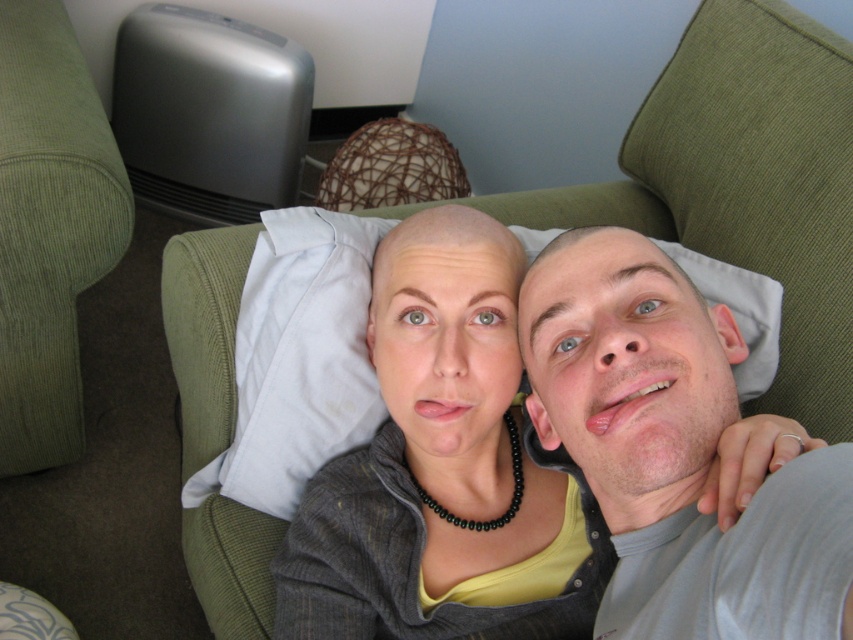
Which is above, matte gray sweater at center or white fabric pillow at center?

Positioned higher is white fabric pillow at center.

Is matte gray sweater at center to the left of white fabric pillow at center from the viewer's perspective?

Yes, matte gray sweater at center is to the left of white fabric pillow at center.

Between point (381, 634) and point (366, 428), which one is positioned behind?

The point (366, 428) is behind.

The width and height of the screenshot is (853, 640). What are the coordinates of `matte gray sweater at center` in the screenshot? It's located at (444, 468).

Is matte gray sweater at center positioned behind gray fabric shirt at upper right?

Yes, matte gray sweater at center is behind gray fabric shirt at upper right.

Who is positioned more to the left, matte gray sweater at center or gray fabric shirt at upper right?

Positioned to the left is matte gray sweater at center.

What do you see at coordinates (444, 468) in the screenshot? I see `matte gray sweater at center` at bounding box center [444, 468].

Image resolution: width=853 pixels, height=640 pixels. In order to click on matte gray sweater at center in this screenshot , I will do `click(444, 468)`.

Is gray fabric shirt at upper right shorter than white fabric pillow at center?

Yes.

Does gray fabric shirt at upper right have a smaller size compared to white fabric pillow at center?

Yes, gray fabric shirt at upper right is smaller than white fabric pillow at center.

Between point (758, 573) and point (753, 278), which one is positioned behind?

The point (753, 278) is behind.

This screenshot has width=853, height=640. In order to click on gray fabric shirt at upper right in this screenshot , I will do `click(675, 451)`.